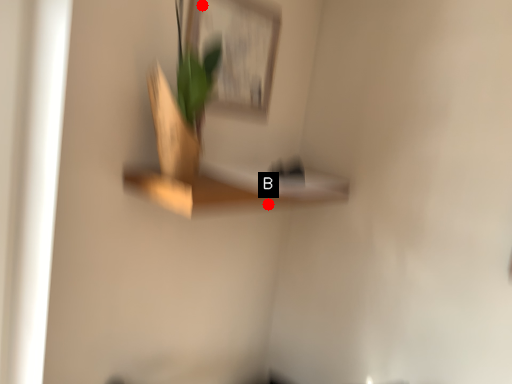
Question: Two points are circled on the image, labeled by A and B beside each circle. Which point appears farthest from the camera in this image?

Choices:
 (A) A is further
 (B) B is further

Answer: (B)